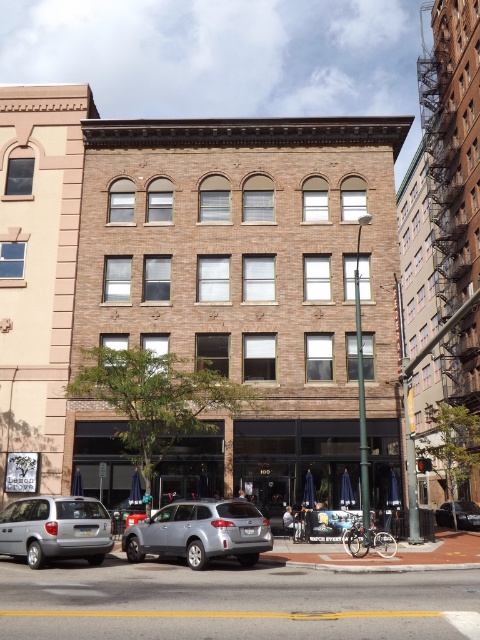
You are a delivery driver approaching the building and need to park your satin silver suv at center. The parking spot is located at coordinates 0.833, 0.419. Is your vehicle currently positioned correctly for parking?

The satin silver suv at center is located at point (201, 532), so yes, it is correctly positioned for parking at the designated spot.

You are a pedestrian standing on the sidewalk in front of the multi story brick building. You see the silver metallic minivan at lower left and the silver metallic sedan at center. Which vehicle is closer to you?

The silver metallic minivan at lower left is closer to the viewer than the silver metallic sedan at center.

You are a pedestrian standing on the sidewalk in front of the building. You see the silver metallic minivan at lower left and the silver metallic sedan at center. Which vehicle is parked closer to the building?

The silver metallic sedan at center is parked closer to the building because the silver metallic minivan at lower left is located above it, indicating it is positioned higher up and farther away from the base of the building.